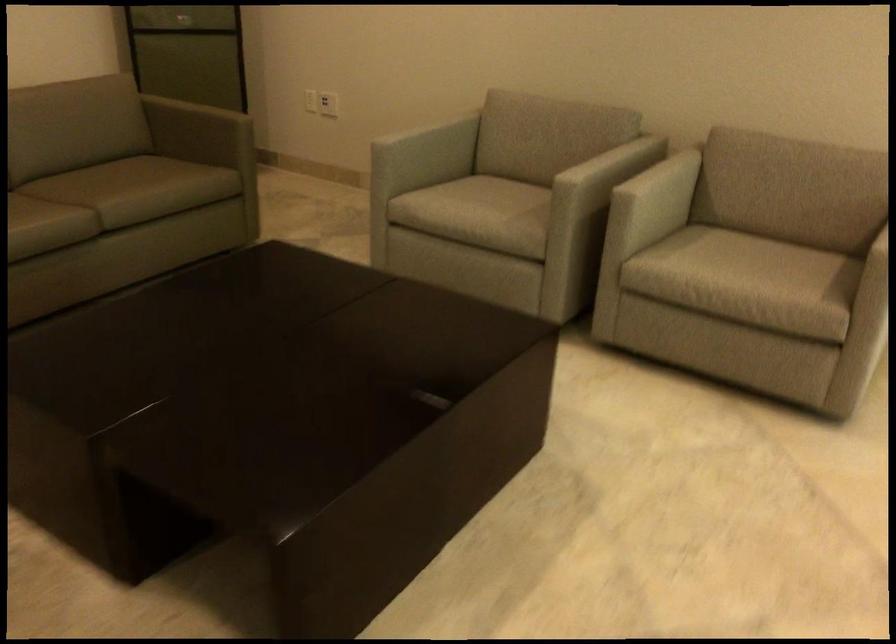
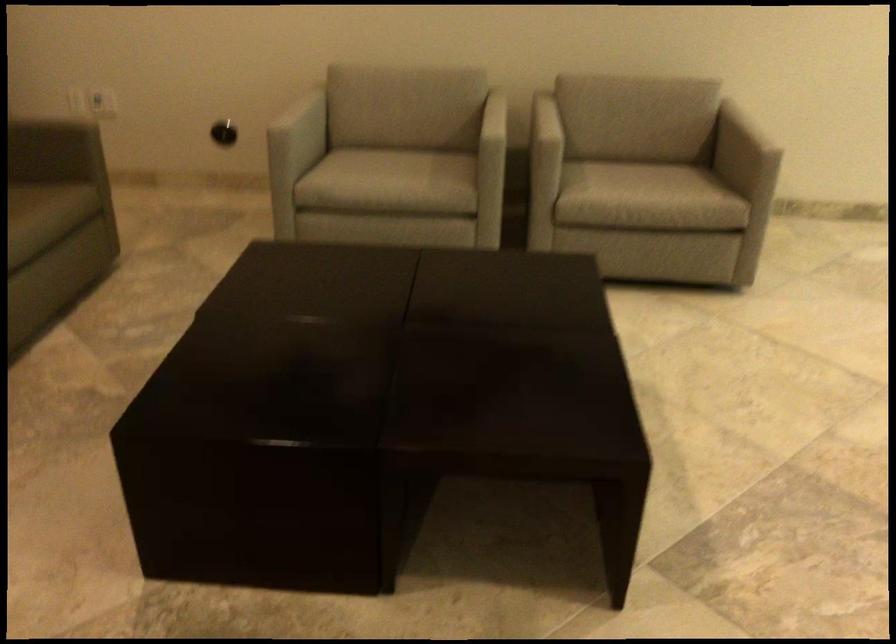
Locate, in the second image, the point that corresponds to the point at 168,192 in the first image.

(36, 219)